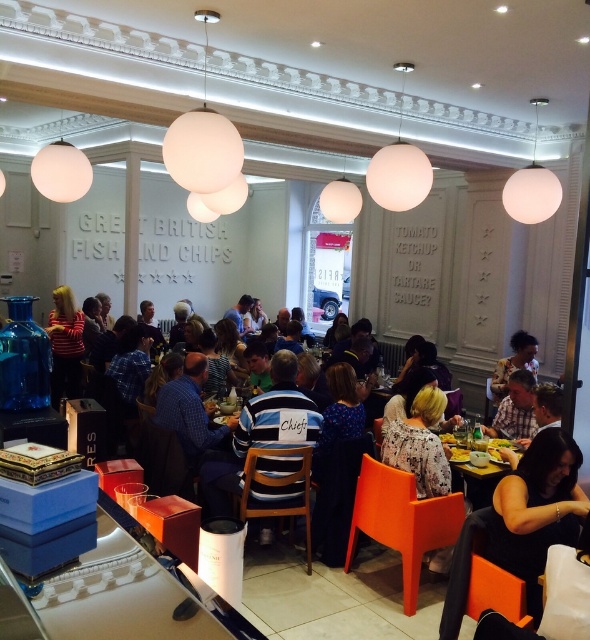
Can you confirm if matte striped shirt at center is taller than yellow plastic table at center?

Yes, matte striped shirt at center is taller than yellow plastic table at center.

Can you confirm if matte striped shirt at center is positioned to the left of yellow plastic table at center?

In fact, matte striped shirt at center is to the right of yellow plastic table at center.

Does point (520, 404) lie in front of point (467, 472)?

No, it is behind (467, 472).

This screenshot has width=590, height=640. Identify the location of matte striped shirt at center. (514, 408).

Does matte striped shirt at center appear under floral-patterned blouse at center?

Yes.

What do you see at coordinates (514, 408) in the screenshot? Image resolution: width=590 pixels, height=640 pixels. I see `matte striped shirt at center` at bounding box center [514, 408].

At what (x,y) coordinates should I click in order to perform the action: click on matte striped shirt at center. Please return your answer as a coordinate pair (x, y). Looking at the image, I should click on (514, 408).

Does floral-patterned blouse at center come behind yellow plastic table at center?

Yes, it is.

Locate an element on the screen. This screenshot has width=590, height=640. floral-patterned blouse at center is located at coordinates pyautogui.click(x=513, y=362).

Which is in front, point (527, 337) or point (491, 458)?

Point (491, 458)

Locate an element on the screen. The image size is (590, 640). floral-patterned blouse at center is located at coordinates (513, 362).